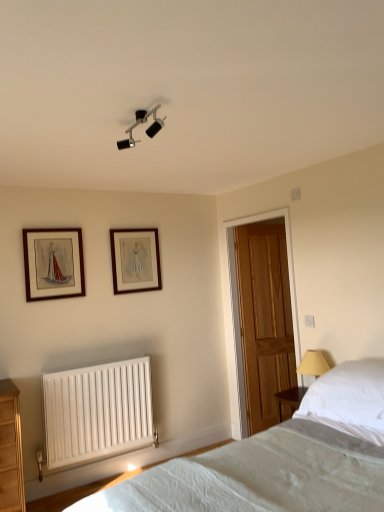
Question: From a real-world perspective, is wooden door at center positioned above or below white fabric bed at lower right?

Choices:
 (A) above
 (B) below

Answer: (A)

Question: Considering the positions of wooden door at center and white fabric bed at lower right in the image, is wooden door at center taller or shorter than white fabric bed at lower right?

Choices:
 (A) short
 (B) tall

Answer: (B)

Question: Based on their relative distances, which object is farther from the wooden framed picture at upper left, which ranks as the 2th picture frame in right-to-left order?

Choices:
 (A) wooden door at center
 (B) wooden picture frame at upper center, placed as the second picture frame when sorted from front to back
 (C) white soft pillow at right
 (D) white matte radiator at lower left
 (E) white fabric bed at lower right

Answer: (C)

Question: Based on their relative distances, which object is nearer to the wooden framed picture at upper left, which is the first picture frame in front-to-back order?

Choices:
 (A) wooden picture frame at upper center, which appears as the 1th picture frame when viewed from the back
 (B) matte black light fixture at upper center
 (C) white soft pillow at right
 (D) wooden door at center
 (E) white matte radiator at lower left

Answer: (A)